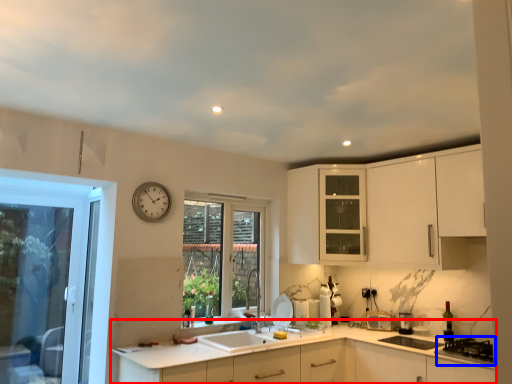
Question: Among these objects, which one is nearest to the camera, countertop (highlighted by a red box) or gas stove (highlighted by a blue box)?

Choices:
 (A) countertop
 (B) gas stove

Answer: (A)